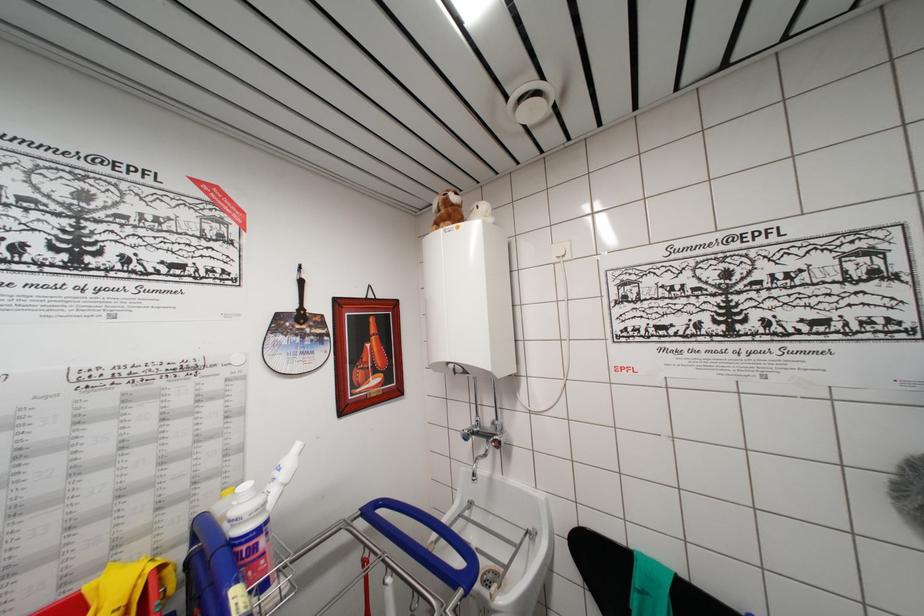
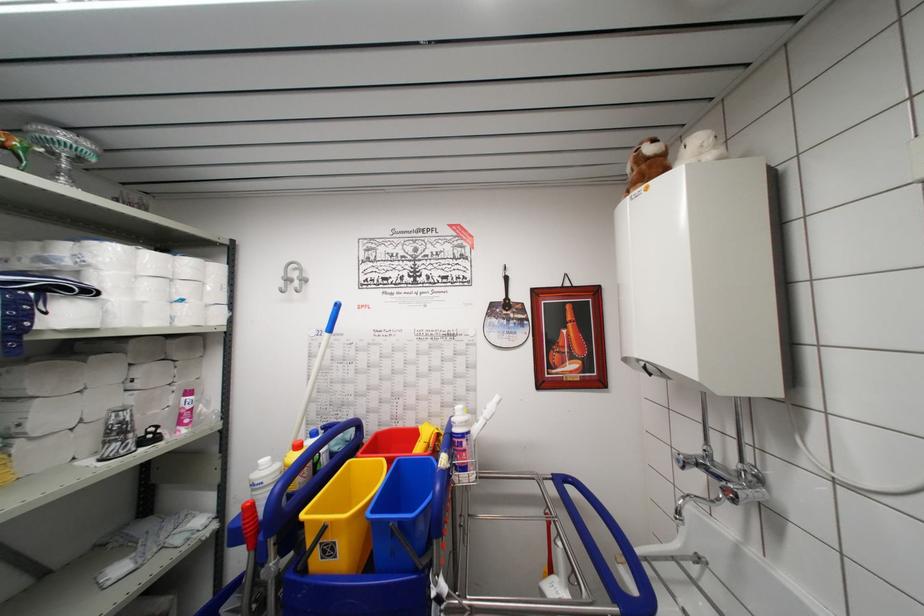
Locate, in the second image, the point that corresponds to pixel 251 553 in the first image.

(460, 447)